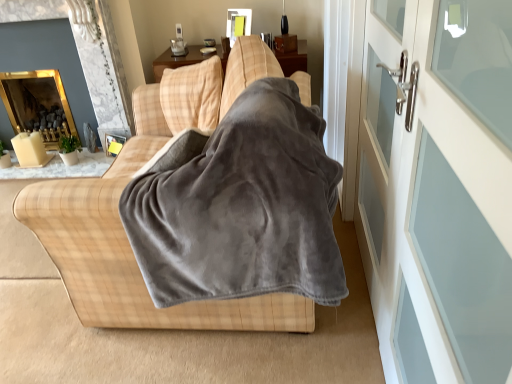
Question: Is gold reflective mirror at upper left, positioned as the 1th fireplace in back-to-front order, oriented towards white glass door at right, acting as the 1th screen door starting from the front?

Choices:
 (A) yes
 (B) no

Answer: (B)

Question: Does gold reflective mirror at upper left, positioned as the 1th fireplace in back-to-front order, have a smaller size compared to white glass door at right, acting as the 1th screen door starting from the front?

Choices:
 (A) no
 (B) yes

Answer: (A)

Question: Would you say gold reflective mirror at upper left, placed as the second fireplace when sorted from front to back, contains white glass door at right, acting as the 1th screen door starting from the front?

Choices:
 (A) no
 (B) yes

Answer: (A)

Question: Is gold reflective mirror at upper left, positioned as the 1th fireplace in back-to-front order, at the left side of white glass door at right, acting as the 1th screen door starting from the front?

Choices:
 (A) yes
 (B) no

Answer: (A)

Question: From a real-world perspective, is gold reflective mirror at upper left, positioned as the 1th fireplace in back-to-front order, positioned over white glass door at right, acting as the 1th screen door starting from the front, based on gravity?

Choices:
 (A) no
 (B) yes

Answer: (A)

Question: Visually, is gray fleece blanket at center positioned to the left or to the right of white glass screen door at right, the second screen door when ordered from front to back?

Choices:
 (A) left
 (B) right

Answer: (A)

Question: Looking at the image, does gray fleece blanket at center seem bigger or smaller compared to white glass screen door at right, the second screen door when ordered from front to back?

Choices:
 (A) small
 (B) big

Answer: (B)

Question: Is point (257, 92) closer or farther from the camera than point (367, 129)?

Choices:
 (A) closer
 (B) farther

Answer: (A)

Question: In terms of width, does gray fleece blanket at center look wider or thinner when compared to white glass screen door at right, the second screen door when ordered from front to back?

Choices:
 (A) wide
 (B) thin

Answer: (A)

Question: From the image's perspective, relative to plaid fabric couch at center, is gold reflective mirror at upper left, positioned as the 1th fireplace in back-to-front order, above or below?

Choices:
 (A) below
 (B) above

Answer: (B)

Question: Is gold reflective mirror at upper left, placed as the second fireplace when sorted from front to back, in front of or behind plaid fabric couch at center in the image?

Choices:
 (A) behind
 (B) front

Answer: (A)

Question: Looking at the image, does gold reflective mirror at upper left, positioned as the 1th fireplace in back-to-front order, seem bigger or smaller compared to plaid fabric couch at center?

Choices:
 (A) big
 (B) small

Answer: (B)

Question: Would you say gold reflective mirror at upper left, placed as the second fireplace when sorted from front to back, is to the left or to the right of plaid fabric couch at center in the picture?

Choices:
 (A) right
 (B) left

Answer: (B)

Question: Considering the relative positions of gold reflective fireplace at upper left, positioned as the first fireplace in front-to-back order, and plaid fabric couch at center in the image provided, is gold reflective fireplace at upper left, positioned as the first fireplace in front-to-back order, to the left or to the right of plaid fabric couch at center?

Choices:
 (A) left
 (B) right

Answer: (A)

Question: Relative to plaid fabric couch at center, is gold reflective fireplace at upper left, the 2th fireplace from the back, in front or behind?

Choices:
 (A) front
 (B) behind

Answer: (B)